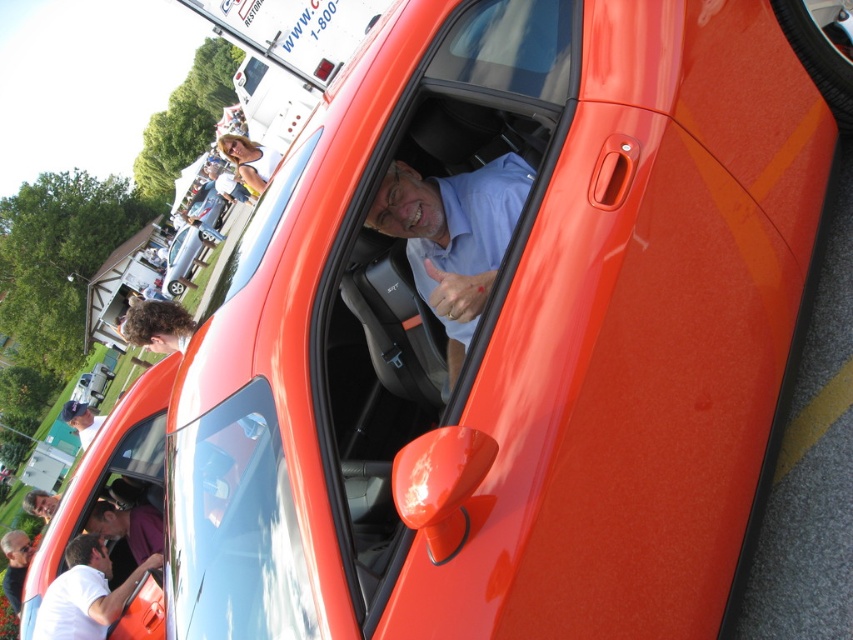
You are a photographer standing at the edge of the car show. You want to take a photo of the matte blue shirt at center and matte black car door at center in the same frame. Given that your camera has a maximum focus range of 6 meters, will you be able to capture both objects clearly in the photo?

The matte blue shirt at center and matte black car door at center are 6.84 meters apart. Since the distance between them exceeds the camera maximum focus range of 6 meters, the photographer will not be able to capture both objects clearly in the same frame.

You are a photographer at the car show and need to capture both the white matte shirt at lower left and the matte black shirt at lower left in the same frame. Which shirt should you focus on if you want to ensure both are fully visible without cropping?

The white matte shirt at lower left is bigger than the matte black shirt at lower left, so focusing on the white matte shirt at lower left will ensure both shirts are fully visible without cropping.

You are standing at the center of the image and want to move towards the matte blue shirt at center. Which direction should you move?

Since the matte blue shirt at center is already at the center of the image, you don not need to move in any direction to reach it.